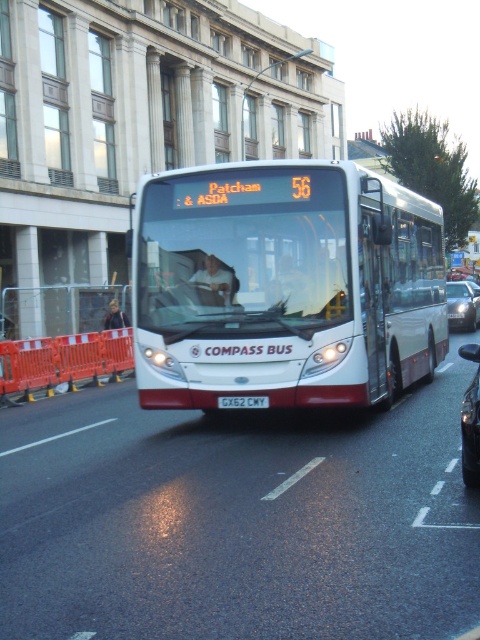
You are a driver who needs to park your car behind the metallic silver car at center so that the white rectangular license plate at center is fully visible from the front. Is this possible given their sizes?

The metallic silver car at center is taller than the white rectangular license plate at center, so if you park your car behind it, the license plate will still be visible as it is shorter than the car.